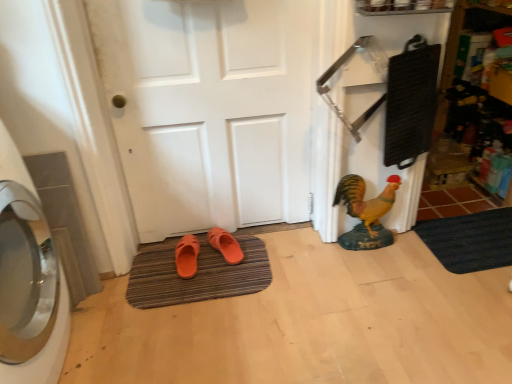
Question: In the image, is brown striped bath mat at center, placed as the second bath mat when sorted from right to left, on the left side or the right side of white matte door at center?

Choices:
 (A) right
 (B) left

Answer: (B)

Question: Considering the positions of brown striped bath mat at center, the first bath mat viewed from the left, and white matte door at center in the image, is brown striped bath mat at center, the first bath mat viewed from the left, taller or shorter than white matte door at center?

Choices:
 (A) tall
 (B) short

Answer: (B)

Question: Considering the real-world distances, which object is farthest from the white matte door at center?

Choices:
 (A) brown striped bath mat at center, placed as the second bath mat when sorted from right to left
 (B) orange matte slippers at center, arranged as the 2th footwear when viewed from the left
 (C) silver metallic washing machine at left
 (D) black rubber bath mat at lower right, marked as the second bath mat in a left-to-right arrangement
 (E) orange rubber slipper at lower center, which is the second footwear from right to left

Answer: (D)

Question: Which object is positioned closest to the orange matte slippers at center, arranged as the 2th footwear when viewed from the left?

Choices:
 (A) brown striped bath mat at center, placed as the second bath mat when sorted from right to left
 (B) white matte door at center
 (C) silver metallic washing machine at left
 (D) black rubber bath mat at lower right, which is counted as the 1th bath mat, starting from the right
 (E) orange rubber slipper at lower center, positioned as the first footwear in left-to-right order

Answer: (E)